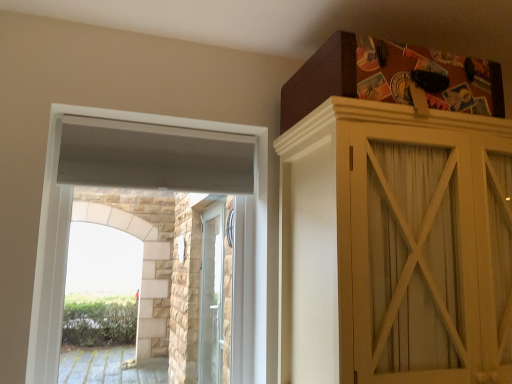
The width and height of the screenshot is (512, 384). Describe the element at coordinates (395, 246) in the screenshot. I see `matte wooden cupboard at upper right` at that location.

Find the location of a particular element. The width and height of the screenshot is (512, 384). matte wooden cupboard at upper right is located at coordinates (395, 246).

Identify the location of white textured window at upper left. Image resolution: width=512 pixels, height=384 pixels. (52, 227).

This screenshot has height=384, width=512. What do you see at coordinates (52, 227) in the screenshot?
I see `white textured window at upper left` at bounding box center [52, 227].

The width and height of the screenshot is (512, 384). What are the coordinates of `matte wooden cupboard at upper right` in the screenshot? It's located at (395, 246).

Is matte wooden cupboard at upper right at the left side of white textured window at upper left?

Incorrect, matte wooden cupboard at upper right is not on the left side of white textured window at upper left.

Is matte wooden cupboard at upper right closer to camera compared to white textured window at upper left?

That is True.

Between point (453, 145) and point (270, 298), which one is positioned behind?

The point (270, 298) is farther.

Looking at this image, from the image's perspective, which one is positioned lower, matte wooden cupboard at upper right or white textured window at upper left?

matte wooden cupboard at upper right appears lower in the image.

From a real-world perspective, does matte wooden cupboard at upper right stand above white textured window at upper left?

Actually, matte wooden cupboard at upper right is physically below white textured window at upper left in the real world.

Can you confirm if matte wooden cupboard at upper right is wider than white textured window at upper left?

Yes, matte wooden cupboard at upper right is wider than white textured window at upper left.

Looking at this image, considering the sizes of objects matte wooden cupboard at upper right and white textured window at upper left in the image provided, who is taller, matte wooden cupboard at upper right or white textured window at upper left?

white textured window at upper left is taller.

Considering the sizes of objects matte wooden cupboard at upper right and white textured window at upper left in the image provided, who is bigger, matte wooden cupboard at upper right or white textured window at upper left?

Bigger between the two is matte wooden cupboard at upper right.

Is matte wooden cupboard at upper right surrounding white textured window at upper left?

No.

Is matte wooden cupboard at upper right not close to white textured window at upper left?

They are positioned close to each other.

Is matte wooden cupboard at upper right facing away from white textured window at upper left?

No.

What's the angular difference between matte wooden cupboard at upper right and white textured window at upper left's facing directions?

The angle between the facing direction of matte wooden cupboard at upper right and the facing direction of white textured window at upper left is 0.657 degrees.

This screenshot has width=512, height=384. Identify the location of window on the left of the matte wooden cupboard at upper right. (52, 227).

Which is more to the right, white textured window at upper left or matte wooden cupboard at upper right?

Positioned to the right is matte wooden cupboard at upper right.

Is the position of white textured window at upper left more distant than that of matte wooden cupboard at upper right?

That is True.

Is point (53, 358) closer or farther from the camera than point (293, 373)?

Clearly, point (53, 358) is more distant from the camera than point (293, 373).

From the image's perspective, which is above, white textured window at upper left or matte wooden cupboard at upper right?

white textured window at upper left, from the image's perspective.

From a real-world perspective, which is physically below, white textured window at upper left or matte wooden cupboard at upper right?

From a 3D spatial view, matte wooden cupboard at upper right is below.

Which of these two, white textured window at upper left or matte wooden cupboard at upper right, is thinner?

white textured window at upper left.

From their relative heights in the image, would you say white textured window at upper left is taller or shorter than matte wooden cupboard at upper right?

Clearly, white textured window at upper left is taller compared to matte wooden cupboard at upper right.

Does white textured window at upper left have a larger size compared to matte wooden cupboard at upper right?

Actually, white textured window at upper left might be smaller than matte wooden cupboard at upper right.

Would you say matte wooden cupboard at upper right is part of white textured window at upper left's contents?

No.

Is the surface of white textured window at upper left in direct contact with matte wooden cupboard at upper right?

No, white textured window at upper left is not touching matte wooden cupboard at upper right.

Is white textured window at upper left oriented towards matte wooden cupboard at upper right?

No, white textured window at upper left is not oriented towards matte wooden cupboard at upper right.

Can you tell me how much white textured window at upper left and matte wooden cupboard at upper right differ in facing direction?

There is a 0.657-degree angle between the facing directions of white textured window at upper left and matte wooden cupboard at upper right.

Locate an element on the screen. window behind the matte wooden cupboard at upper right is located at coordinates (52, 227).

Locate an element on the screen. The width and height of the screenshot is (512, 384). window above the matte wooden cupboard at upper right (from a real-world perspective) is located at coordinates (52, 227).

The height and width of the screenshot is (384, 512). I want to click on window above the matte wooden cupboard at upper right (from the image's perspective), so click(52, 227).